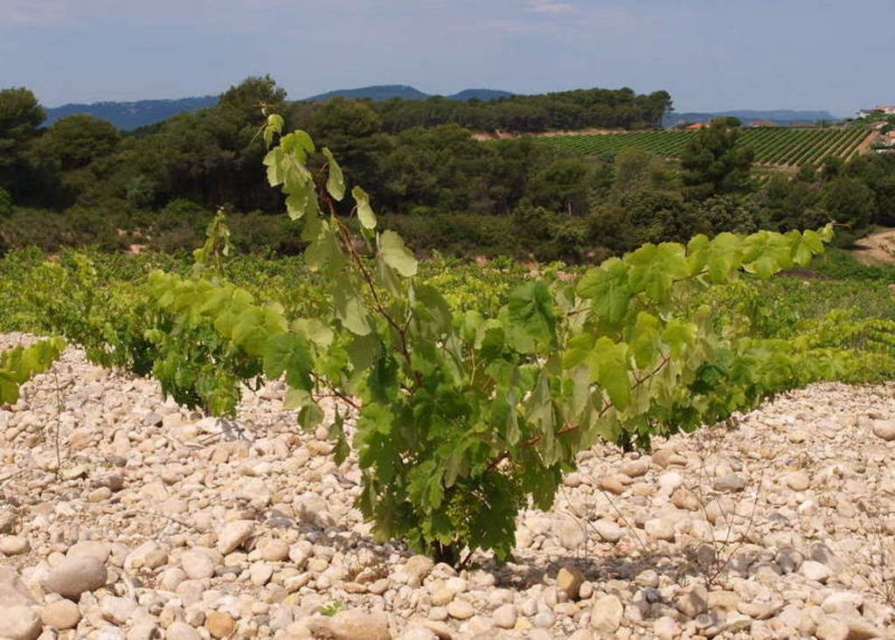
You are a gardener planning to water the green leafy plant at center and the light brown gravel at center. Which one should you water first if you want to ensure the water reaches the roots of the plant efficiently?

The green leafy plant at center should be watered first because the light brown gravel at center is located below it. Watering the plant first allows the water to flow downward through the gravel, ensuring the roots receive adequate moisture.

Based on the photo, you are a gardener planning to plant a new row of grapevines in the vineyard. You have two options for ground cover between the rows. One is the light brown gravel at center, and the other is the green leafy plant at center. Considering their sizes, which ground cover would allow for better water retention in the soil? Please explain your reasoning based on the provided information.

The green leafy plant at center would allow for better water retention in the soil because it has a larger size compared to the light brown gravel at center. Larger plants can provide more shade and reduce evaporation, while smaller gravel might not effectively retain moisture.